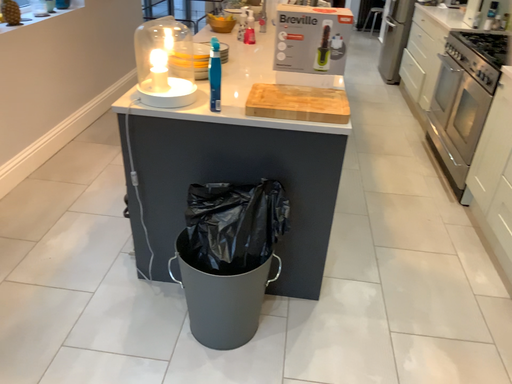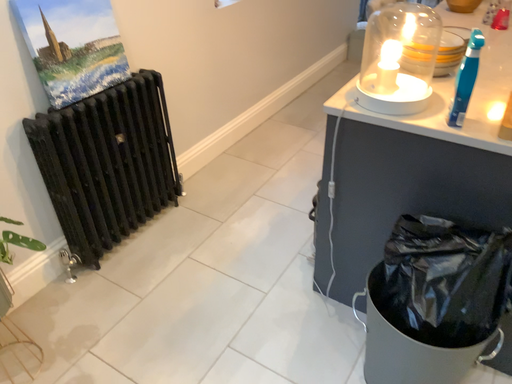
Question: How did the camera likely rotate when shooting the video?

Choices:
 (A) rotated left
 (B) rotated right

Answer: (A)